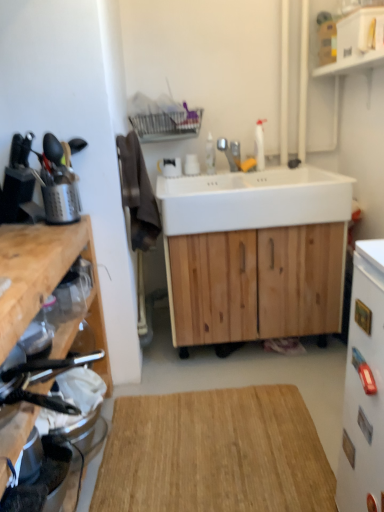
Find the location of `free space in front of metallic silver utensil holder at left, the second appliance positioned from the left`. free space in front of metallic silver utensil holder at left, the second appliance positioned from the left is located at coordinates (39, 233).